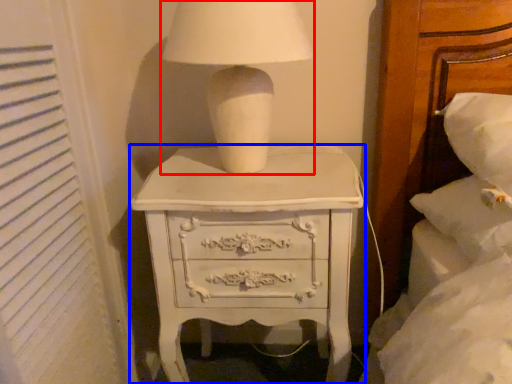
Question: Which of the following is the farthest to the observer, table lamp (highlighted by a red box) or chest of drawers (highlighted by a blue box)?

Choices:
 (A) table lamp
 (B) chest of drawers

Answer: (B)